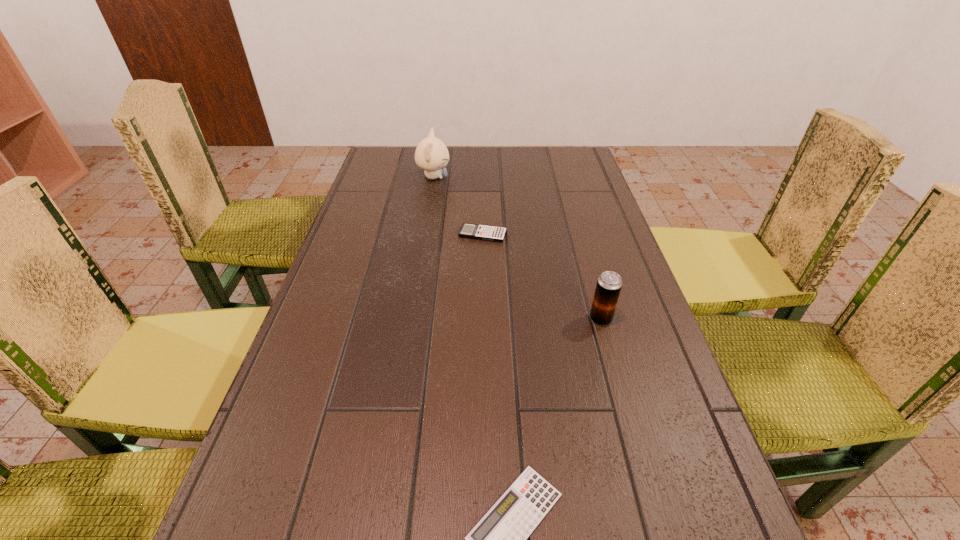
The image size is (960, 540). Identify the location of vacant area between the farther calculator and the second tallest object. pos(541,276).

Locate an element on the screen. This screenshot has height=540, width=960. object that is the second nearest to the kitten is located at coordinates (609, 284).

Where is `the second closest object to the second shortest object`? the second closest object to the second shortest object is located at coordinates (609, 284).

Image resolution: width=960 pixels, height=540 pixels. I want to click on free space that satisfies the following two spatial constraints: 1. on the face of the tallest object; 2. on the back side of the second shortest object, so click(x=424, y=234).

Locate an element on the screen. The width and height of the screenshot is (960, 540). vacant position in the image that satisfies the following two spatial constraints: 1. on the face of the beer can; 2. on the left side of the farthest object is located at coordinates (411, 319).

Find the location of `free space that satisfies the following two spatial constraints: 1. on the face of the second shortest object; 2. on the left side of the tallest object`. free space that satisfies the following two spatial constraints: 1. on the face of the second shortest object; 2. on the left side of the tallest object is located at coordinates (424, 234).

Identify the location of free space that satisfies the following two spatial constraints: 1. on the face of the kitten; 2. on the back side of the beer can. The width and height of the screenshot is (960, 540). point(411,319).

This screenshot has width=960, height=540. I want to click on vacant region that satisfies the following two spatial constraints: 1. on the face of the rightmost object; 2. on the left side of the kitten, so click(411, 319).

The height and width of the screenshot is (540, 960). Find the location of `vacant region that satisfies the following two spatial constraints: 1. on the face of the leftmost object; 2. on the left side of the second tallest object`. vacant region that satisfies the following two spatial constraints: 1. on the face of the leftmost object; 2. on the left side of the second tallest object is located at coordinates (411, 319).

Find the location of a particular element. vacant space that satisfies the following two spatial constraints: 1. on the back side of the taller calculator; 2. on the face of the kitten is located at coordinates (482, 177).